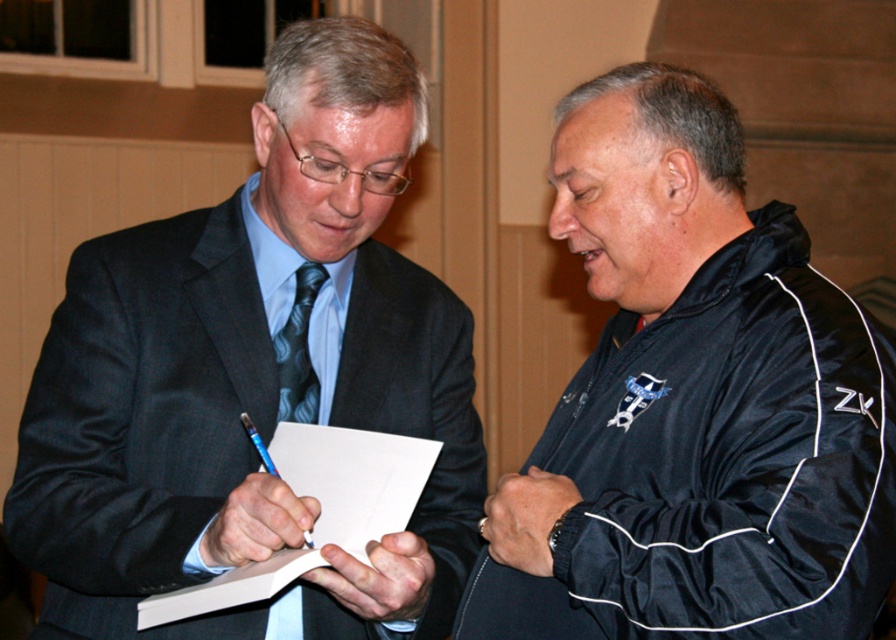
Question: Which point is closer to the camera?

Choices:
 (A) (373, 461)
 (B) (547, 458)

Answer: (A)

Question: Does white paper at center come behind matte black tie at left?

Choices:
 (A) yes
 (B) no

Answer: (B)

Question: Which object is closer to the camera taking this photo?

Choices:
 (A) black fabric jacket at right
 (B) matte black tie at left
 (C) white paper at center

Answer: (A)

Question: Is black fabric jacket at right to the left of matte black tie at left from the viewer's perspective?

Choices:
 (A) yes
 (B) no

Answer: (B)

Question: Estimate the real-world distances between objects in this image. Which object is closer to the matte black tie at left?

Choices:
 (A) white paper at center
 (B) black fabric jacket at right

Answer: (A)

Question: Is black fabric jacket at right smaller than matte black tie at left?

Choices:
 (A) yes
 (B) no

Answer: (B)